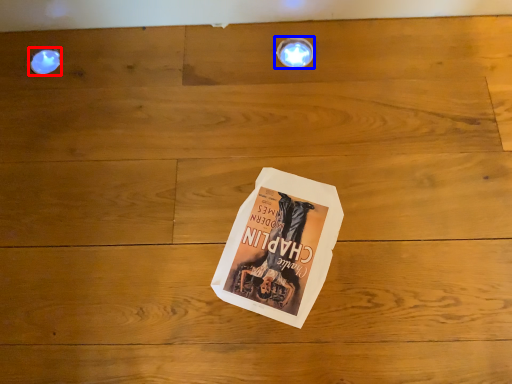
Question: Which point is closer to the camera, droplight (highlighted by a red box) or light fixture (highlighted by a blue box)?

Choices:
 (A) droplight
 (B) light fixture

Answer: (B)